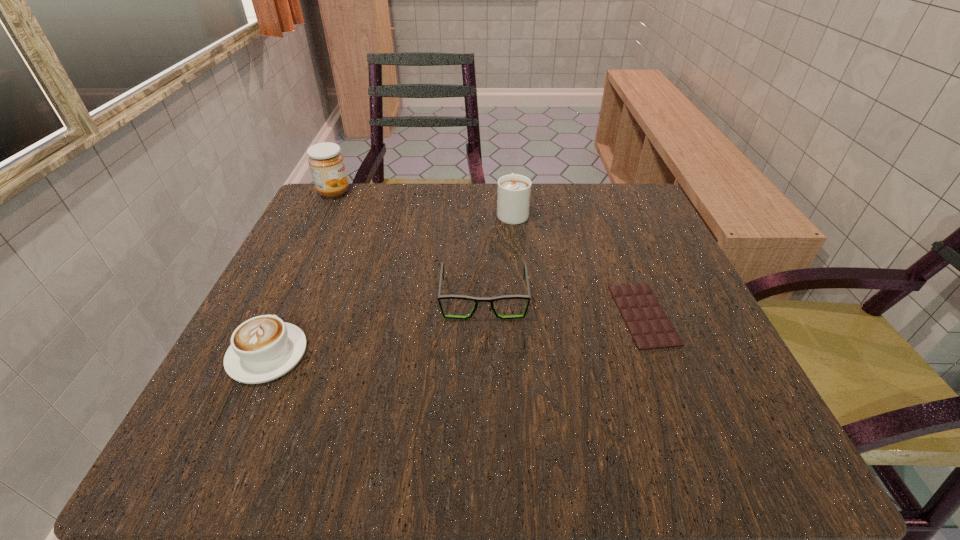
Where is `vacant region located 0.250m with the handle on the right side of the left cappuccino`? This screenshot has height=540, width=960. vacant region located 0.250m with the handle on the right side of the left cappuccino is located at coordinates (322, 237).

What are the coordinates of `vacant region located 0.290m with the handle on the right side of the left cappuccino` in the screenshot? It's located at (326, 226).

Find the location of `vacant space located 0.070m with the handle on the right side of the left cappuccino`. vacant space located 0.070m with the handle on the right side of the left cappuccino is located at coordinates (294, 296).

At what (x,y) coordinates should I click in order to perform the action: click on vacant area situated 0.090m on the back of the rightmost object. Please return your answer as a coordinate pair (x, y). Looking at the image, I should click on (620, 254).

Locate an element on the screen. jam that is at the far edge is located at coordinates click(326, 163).

Identify the location of cappuccino positioned at the far edge. (513, 196).

Find the location of a particular element. jam that is at the left edge is located at coordinates (326, 163).

The width and height of the screenshot is (960, 540). I want to click on cappuccino located at the left edge, so click(x=263, y=348).

Identify the location of object present at the right edge. The image size is (960, 540). (649, 326).

Where is `object that is at the far left corner`? The image size is (960, 540). object that is at the far left corner is located at coordinates (326, 163).